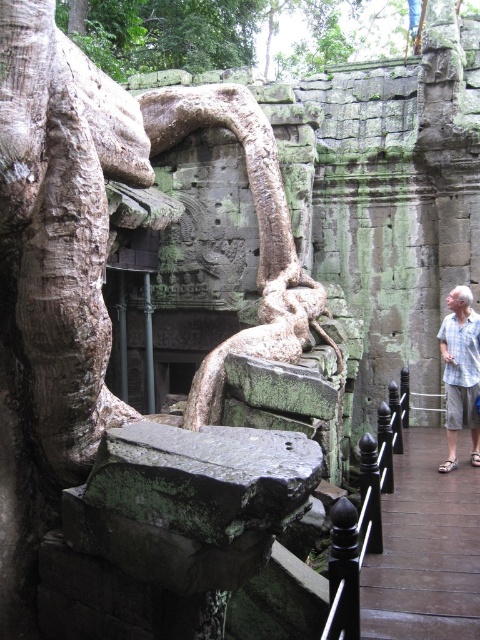
You are a tour guide explaining the historical site to visitors. You point out the brown wooden path at right and the black polished metal railing at center. Which one is smaller in size?

The brown wooden path at right is smaller in size than the black polished metal railing at center because it occupies less space.

You are a visitor standing on the wooden walkway and want to take a photo of the carved relief in the background. To avoid blocking the relief with your hand, you need to know which object is closer to you. Which is closer between the green mossy roots at upper center and the black polished metal railing at center?

The green mossy roots at upper center is closer to you than the black polished metal railing at center, so you should position your hand to avoid covering the roots which are in front.